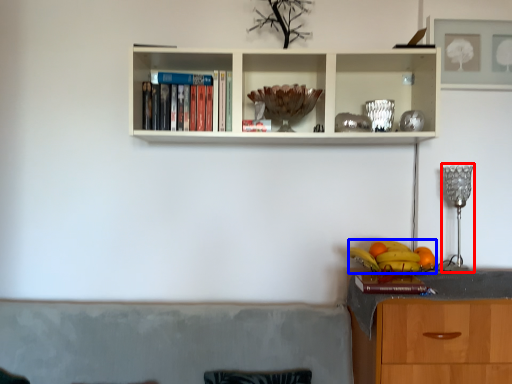
Question: Which of the following is the farthest to the observer, lamp (highlighted by a red box) or fruit (highlighted by a blue box)?

Choices:
 (A) lamp
 (B) fruit

Answer: (A)